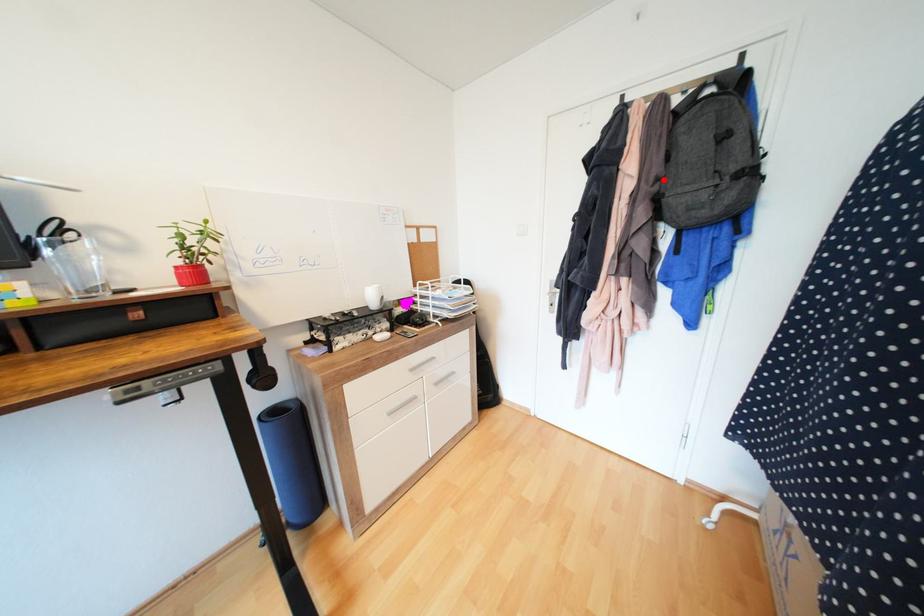
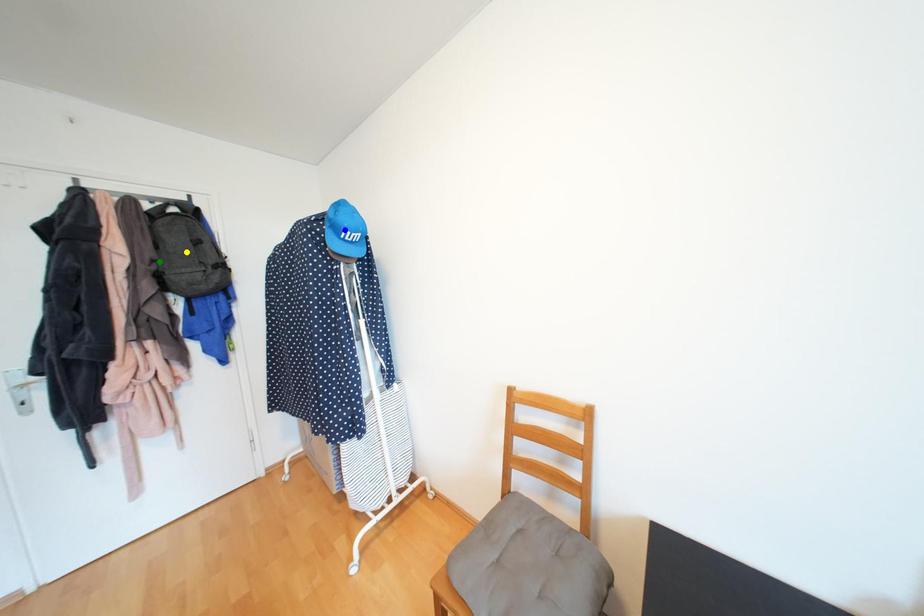
Question: I am providing you with two images of the same scene from different viewpoints. A red point is marked on the first image. You are given multiple points on the second image. Which spot in image 2 lines up with the point in image 1?

Choices:
 (A) blue point
 (B) green point
 (C) yellow point

Answer: (B)